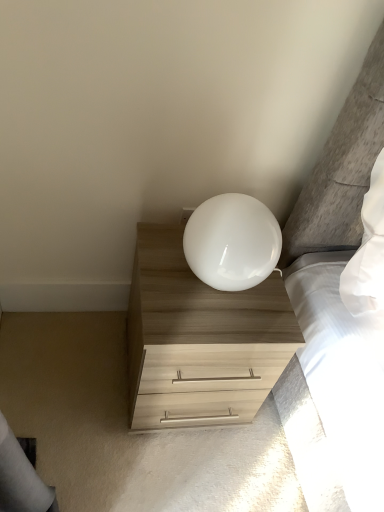
Identify the location of blank space above light wood/texture chest of drawers at lower right (from a real-world perspective). (209, 294).